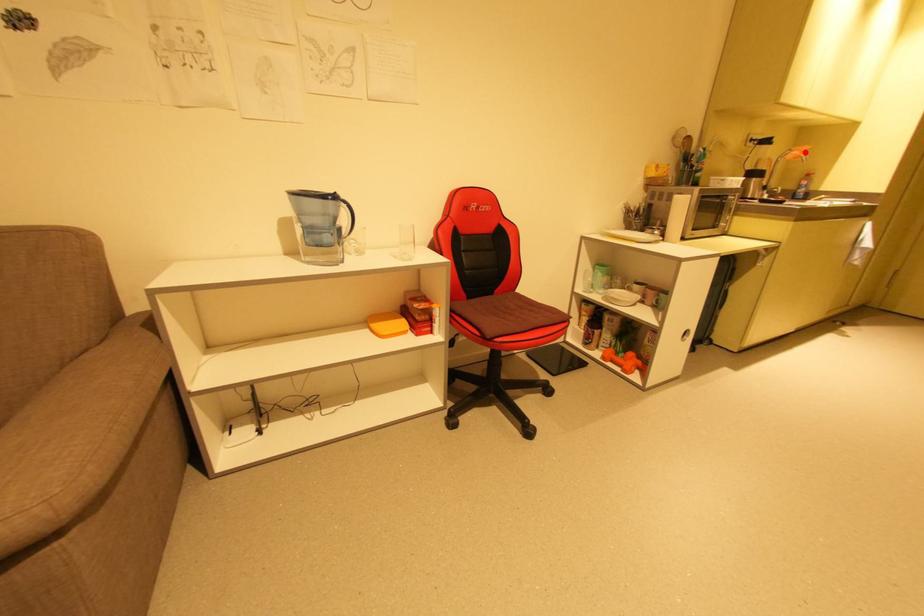
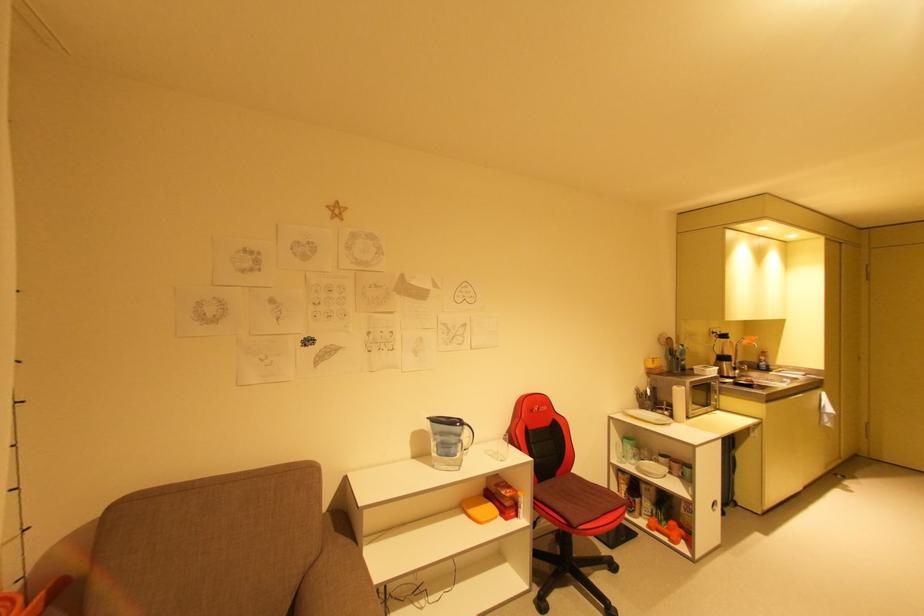
In the second image, find the point that corresponds to the highlighted location in the first image.

(756, 341)